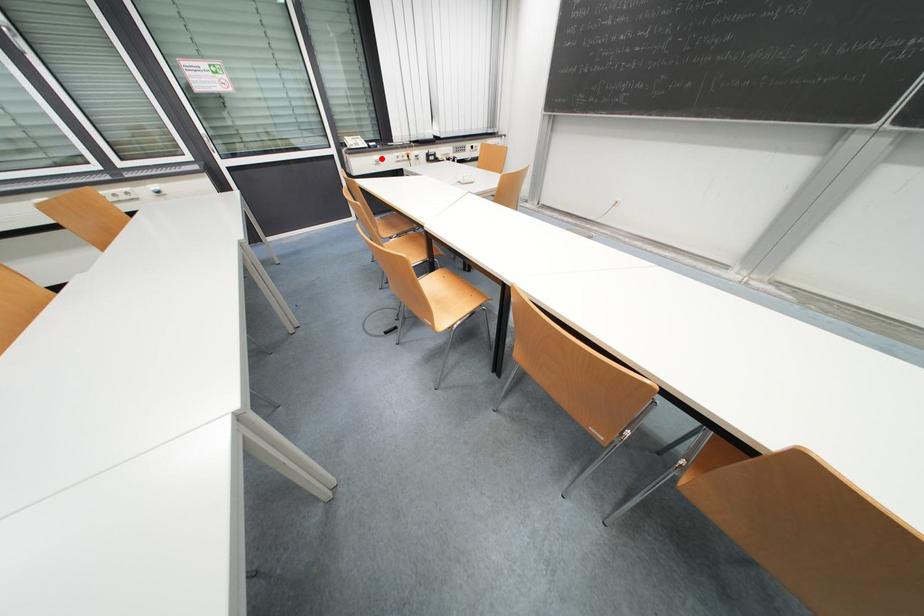
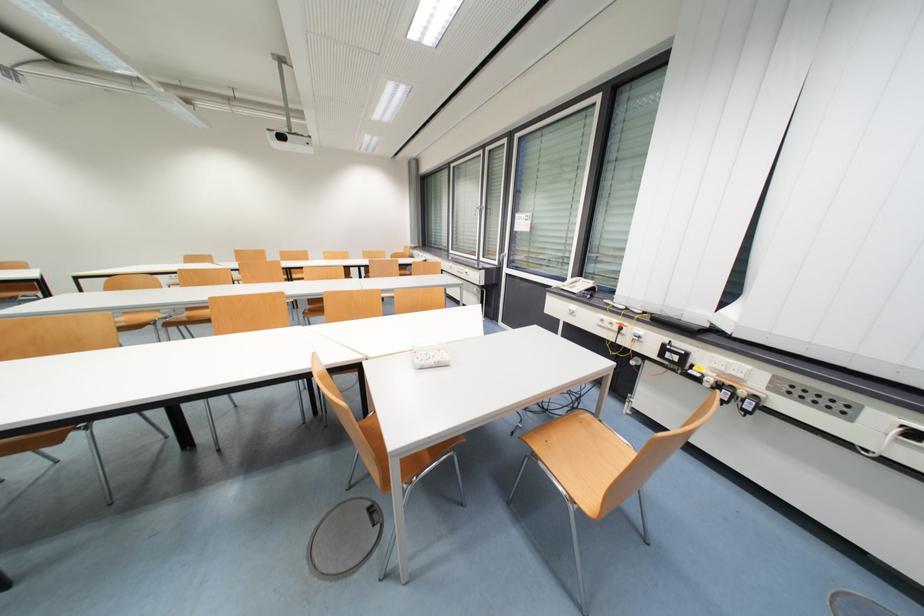
Where in the second image is the point corresponding to the highlighted location from the first image?

(578, 309)